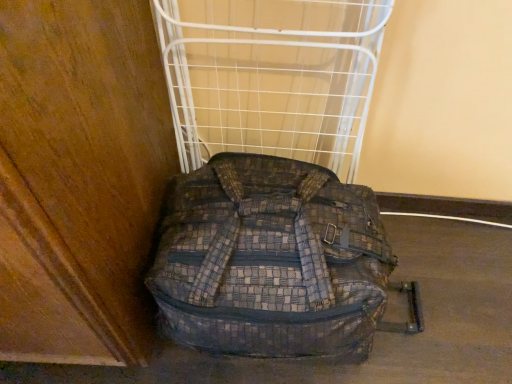
Question: Does white wire rack at center have a greater width compared to plaid fabric backpack at center?

Choices:
 (A) no
 (B) yes

Answer: (A)

Question: Does white wire rack at center have a lesser width compared to plaid fabric backpack at center?

Choices:
 (A) yes
 (B) no

Answer: (A)

Question: Is white wire rack at center beside plaid fabric backpack at center?

Choices:
 (A) yes
 (B) no

Answer: (B)

Question: Is white wire rack at center oriented towards plaid fabric backpack at center?

Choices:
 (A) yes
 (B) no

Answer: (A)

Question: Is white wire rack at center to the left of plaid fabric backpack at center from the viewer's perspective?

Choices:
 (A) no
 (B) yes

Answer: (B)

Question: From the image's perspective, is white wire rack at center below plaid fabric backpack at center?

Choices:
 (A) yes
 (B) no

Answer: (B)

Question: Considering the relative sizes of plaid fabric backpack at center and white wire rack at center in the image provided, is plaid fabric backpack at center smaller than white wire rack at center?

Choices:
 (A) yes
 (B) no

Answer: (B)

Question: Considering the relative sizes of plaid fabric backpack at center and white wire rack at center in the image provided, is plaid fabric backpack at center bigger than white wire rack at center?

Choices:
 (A) no
 (B) yes

Answer: (B)

Question: Is plaid fabric backpack at center shorter than white wire rack at center?

Choices:
 (A) yes
 (B) no

Answer: (A)

Question: Does plaid fabric backpack at center have a lesser width compared to white wire rack at center?

Choices:
 (A) no
 (B) yes

Answer: (A)

Question: Is plaid fabric backpack at center turned away from white wire rack at center?

Choices:
 (A) no
 (B) yes

Answer: (B)

Question: From a real-world perspective, is plaid fabric backpack at center under white wire rack at center?

Choices:
 (A) no
 (B) yes

Answer: (B)

Question: In the image, is plaid fabric backpack at center on the left side or the right side of white wire rack at center?

Choices:
 (A) right
 (B) left

Answer: (A)